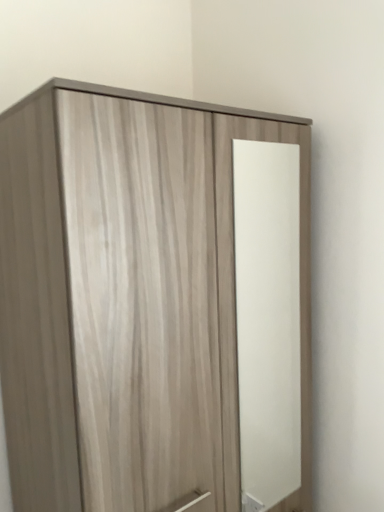
This screenshot has width=384, height=512. Describe the element at coordinates (72, 294) in the screenshot. I see `light brown wood cupboard at center` at that location.

Identify the location of light brown wood cupboard at center. The width and height of the screenshot is (384, 512). (72, 294).

Locate an element on the screen. The width and height of the screenshot is (384, 512). light brown wood cupboard at center is located at coordinates (72, 294).